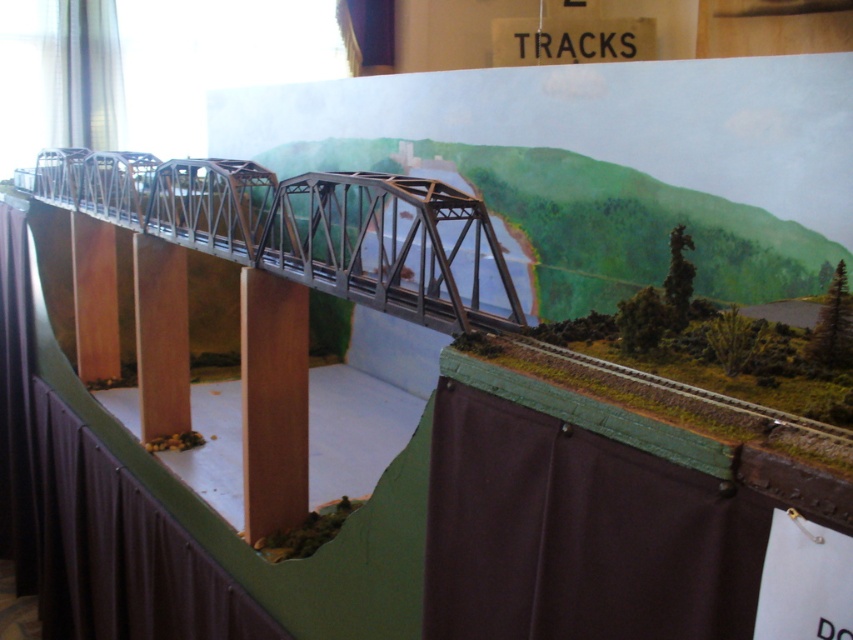
Question: Is metallic gray bridge at center above brown wood pillar at center?

Choices:
 (A) no
 (B) yes

Answer: (B)

Question: Which object is closer to the camera taking this photo?

Choices:
 (A) brown wood pillar at center
 (B) metallic gray bridge at center

Answer: (B)

Question: Is metallic gray bridge at center smaller than brown wood pillar at center?

Choices:
 (A) yes
 (B) no

Answer: (B)

Question: Is metallic gray bridge at center smaller than brown wood pillar at center?

Choices:
 (A) no
 (B) yes

Answer: (A)

Question: Which point is closer to the camera?

Choices:
 (A) metallic gray bridge at center
 (B) brown wood pillar at center

Answer: (A)